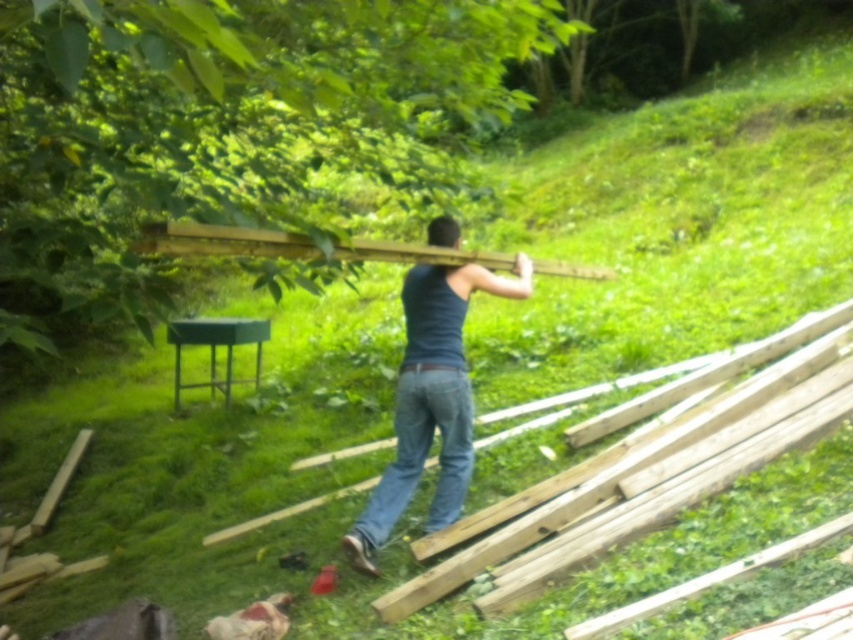
Question: Does dark blue tank top at center lie in front of jeans at center?

Choices:
 (A) no
 (B) yes

Answer: (B)

Question: Can you confirm if natural wood at right is positioned above jeans at center?

Choices:
 (A) no
 (B) yes

Answer: (B)

Question: Which of the following is the closest to the observer?

Choices:
 (A) jeans at center
 (B) natural wood at right
 (C) dark blue tank top at center
 (D) wooden plank at upper center

Answer: (D)

Question: Which point is closer to the camera?

Choices:
 (A) (758, 461)
 (B) (368, 516)
 (C) (146, 250)
 (D) (444, 508)

Answer: (C)

Question: Among these points, which one is nearest to the camera?

Choices:
 (A) (399, 618)
 (B) (358, 545)
 (C) (561, 266)

Answer: (A)

Question: Does natural wood at right have a greater width compared to wooden plank at upper center?

Choices:
 (A) no
 (B) yes

Answer: (B)